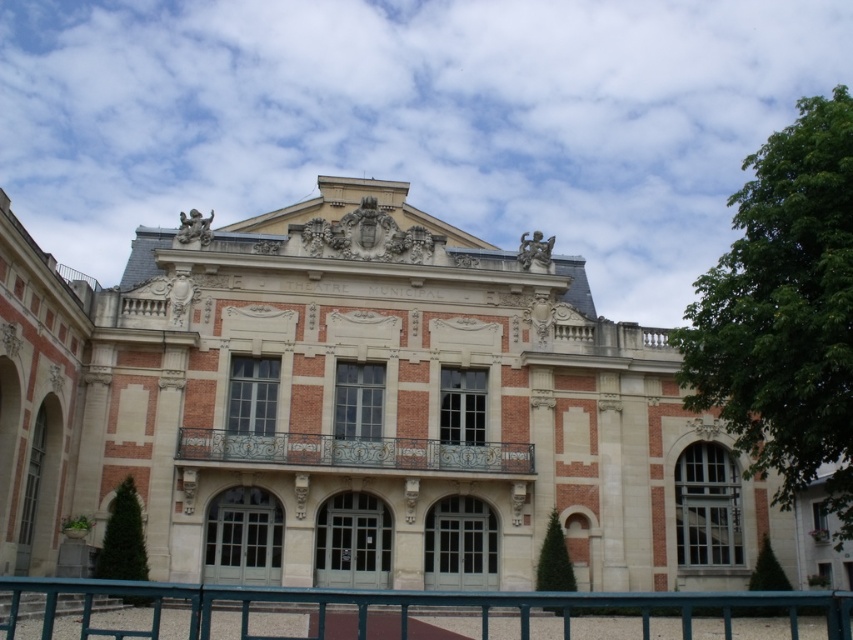
Which of these two, brick building at center or wrought iron balcony at center, stands shorter?

wrought iron balcony at center

Looking at this image, who is taller, brick building at center or wrought iron balcony at center?

brick building at center is taller.

Between point (428, 460) and point (482, 449), which one is positioned in front?

Point (428, 460) is in front.

Image resolution: width=853 pixels, height=640 pixels. Identify the location of brick building at center. (352, 410).

Between teal metal fence at lower center and wrought iron balcony at center, which one is positioned higher?

wrought iron balcony at center is above.

Does point (212, 625) come behind point (413, 458)?

No, it is not.

What are the coordinates of `teal metal fence at lower center` in the screenshot? It's located at (405, 612).

Is brick building at center taller than teal metal fence at lower center?

Yes, brick building at center is taller than teal metal fence at lower center.

The width and height of the screenshot is (853, 640). What are the coordinates of `brick building at center` in the screenshot? It's located at (352, 410).

This screenshot has height=640, width=853. Identify the location of brick building at center. (352, 410).